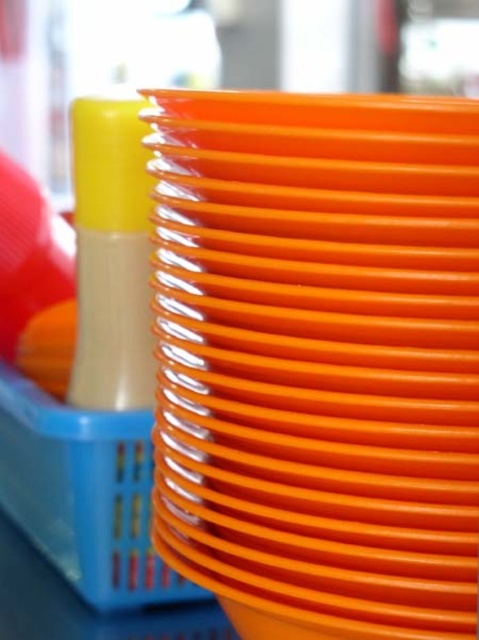
Question: Is orange plastic plate at center closer to camera compared to blue plastic basket at center?

Choices:
 (A) yes
 (B) no

Answer: (A)

Question: Which object is closer to the camera taking this photo?

Choices:
 (A) orange plastic plate at center
 (B) blue plastic basket at center

Answer: (A)

Question: Which point appears closest to the camera in this image?

Choices:
 (A) (239, 253)
 (B) (66, 557)

Answer: (A)

Question: Is orange plastic plate at center wider than blue plastic basket at center?

Choices:
 (A) yes
 (B) no

Answer: (B)

Question: Does orange plastic plate at center have a lesser width compared to blue plastic basket at center?

Choices:
 (A) yes
 (B) no

Answer: (A)